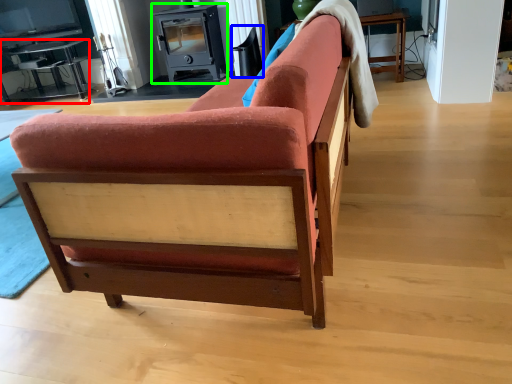
Question: Based on their relative distances, which object is nearer to table (highlighted by a red box)? Choose from swivel chair (highlighted by a blue box) and appliance (highlighted by a green box).

Choices:
 (A) swivel chair
 (B) appliance

Answer: (B)